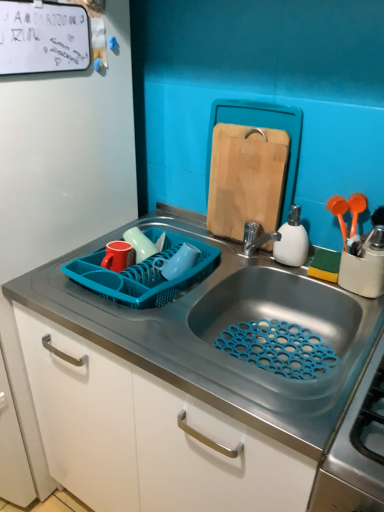
Find the location of a particular element. The image size is (384, 512). wooden cutting board at upper center is located at coordinates (246, 178).

The height and width of the screenshot is (512, 384). Identify the location of white matte dry erase board at upper left. (43, 37).

Describe the element at coordinates (144, 275) in the screenshot. I see `teal plastic basket at sink` at that location.

Where is `blue plastic dish rack at left`? blue plastic dish rack at left is located at coordinates (61, 188).

Is teal plastic basket at sink oriented towards blue plastic dish rack at left?

No, teal plastic basket at sink is not facing towards blue plastic dish rack at left.

Which is more to the right, teal plastic basket at sink or blue plastic dish rack at left?

teal plastic basket at sink.

Is teal plastic basket at sink far away from blue plastic dish rack at left?

No, teal plastic basket at sink is not far away from blue plastic dish rack at left.

Which point is more forward, (156, 291) or (66, 74)?

The point (156, 291) is closer to the camera.

Is white matte soap dispenser at right positioned with its back to white matte dry erase board at upper left?

white matte soap dispenser at right is not turned away from white matte dry erase board at upper left.

Does white matte soap dispenser at right have a smaller size compared to white matte dry erase board at upper left?

No, white matte soap dispenser at right is not smaller than white matte dry erase board at upper left.

From a real-world perspective, who is located higher, white matte soap dispenser at right or white matte dry erase board at upper left?

white matte dry erase board at upper left is physically above.

Is point (196, 240) farther from camera compared to point (207, 225)?

That is False.

Looking at their sizes, would you say teal plastic basket at sink is wider or thinner than wooden cutting board at upper center?

Clearly, teal plastic basket at sink has more width compared to wooden cutting board at upper center.

From the image's perspective, would you say teal plastic basket at sink is positioned over wooden cutting board at upper center?

Actually, teal plastic basket at sink appears below wooden cutting board at upper center in the image.

Considering the relative sizes of teal plastic basket at sink and wooden cutting board at upper center in the image provided, is teal plastic basket at sink bigger than wooden cutting board at upper center?

Yes.

From the image's perspective, is white matte dry erase board at upper left on white matte soap dispenser at right?

Correct, white matte dry erase board at upper left appears higher than white matte soap dispenser at right in the image.

Does point (42, 5) come farther from viewer compared to point (298, 220)?

No, (42, 5) is closer to viewer.

Which is more to the left, white matte dry erase board at upper left or white matte soap dispenser at right?

Positioned to the left is white matte dry erase board at upper left.

Would you say white matte dry erase board at upper left contains white matte soap dispenser at right?

Definitely not — white matte soap dispenser at right is not inside white matte dry erase board at upper left.

From the image's perspective, who appears lower, white matte soap dispenser at right or teal plastic basket at sink?

From the image's view, teal plastic basket at sink is below.

Which is correct: white matte soap dispenser at right is inside teal plastic basket at sink, or outside of it?

white matte soap dispenser at right exists outside the volume of teal plastic basket at sink.

The width and height of the screenshot is (384, 512). I want to click on basket located on the left of white matte soap dispenser at right, so click(144, 275).

Would you say blue plastic dish rack at left contains white matte dry erase board at upper left?

Indeed, white matte dry erase board at upper left is located within blue plastic dish rack at left.

In terms of width, does blue plastic dish rack at left look wider or thinner when compared to white matte dry erase board at upper left?

blue plastic dish rack at left is wider than white matte dry erase board at upper left.

From a real-world perspective, is blue plastic dish rack at left under white matte dry erase board at upper left?

Yes.

Is wooden cutting board at upper center not near blue plastic dish rack at left?

No, wooden cutting board at upper center is not far away from blue plastic dish rack at left.

What's the angular difference between wooden cutting board at upper center and blue plastic dish rack at left's facing directions?

2.83 degrees separate the facing orientations of wooden cutting board at upper center and blue plastic dish rack at left.

From a real-world perspective, is wooden cutting board at upper center on top of blue plastic dish rack at left?

Correct, in the physical world, wooden cutting board at upper center is higher than blue plastic dish rack at left.

Image resolution: width=384 pixels, height=512 pixels. I want to click on basket that is behind the blue plastic dish rack at left, so click(x=144, y=275).

Find the location of a particular element. bulletin board on the left side of white matte soap dispenser at right is located at coordinates (43, 37).

Based on their spatial positions, is wooden cutting board at upper center or white matte soap dispenser at right further from blue plastic dish rack at left?

Based on the image, white matte soap dispenser at right appears to be further to blue plastic dish rack at left.

Estimate the real-world distances between objects in this image. Which object is closer to teal plastic basket at sink, blue plastic dish rack at left or white matte soap dispenser at right?

Based on the image, blue plastic dish rack at left appears to be nearer to teal plastic basket at sink.

Estimate the real-world distances between objects in this image. Which object is further from teal plastic basket at sink, metallic sink at center or blue plastic dish rack at left?

blue plastic dish rack at left.

From the image, which object appears to be nearer to white matte dry erase board at upper left, blue plastic dish rack at left or teal plastic basket at sink?

blue plastic dish rack at left is positioned closer to the anchor white matte dry erase board at upper left.

From the image, which object appears to be nearer to teal plastic basket at sink, metallic sink at center or wooden cutting board at upper center?

Based on the image, metallic sink at center appears to be nearer to teal plastic basket at sink.

Based on their spatial positions, is metallic sink at center or white matte dry erase board at upper left further from white matte soap dispenser at right?

Based on the image, white matte dry erase board at upper left appears to be further to white matte soap dispenser at right.

Looking at the image, which one is located closer to white matte soap dispenser at right, blue plastic dish rack at left or wooden cutting board at upper center?

wooden cutting board at upper center is positioned closer to the anchor white matte soap dispenser at right.

In the scene shown: Based on their spatial positions, is blue plastic dish rack at left or wooden cutting board at upper center further from teal plastic basket at sink?

blue plastic dish rack at left lies further to teal plastic basket at sink than the other object.

The height and width of the screenshot is (512, 384). Find the location of `side between white matte dry erase board at upper left and metallic sink at center from top to bottom`. side between white matte dry erase board at upper left and metallic sink at center from top to bottom is located at coordinates (61, 188).

At what (x,y) coordinates should I click in order to perform the action: click on sink located between teal plastic basket at sink and white matte soap dispenser at right in the left-right direction. Please return your answer as a coordinate pair (x, y). Image resolution: width=384 pixels, height=512 pixels. Looking at the image, I should click on (219, 332).

The height and width of the screenshot is (512, 384). I want to click on bulletin board between blue plastic dish rack at left and white matte soap dispenser at right from left to right, so click(43, 37).

Locate an element on the screen. The height and width of the screenshot is (512, 384). side between white matte dry erase board at upper left and teal plastic basket at sink vertically is located at coordinates (61, 188).